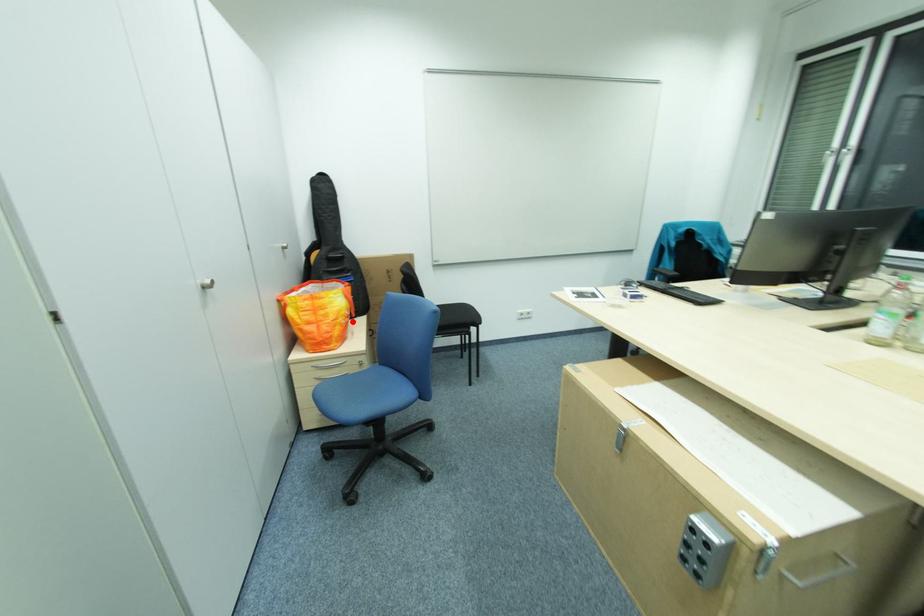
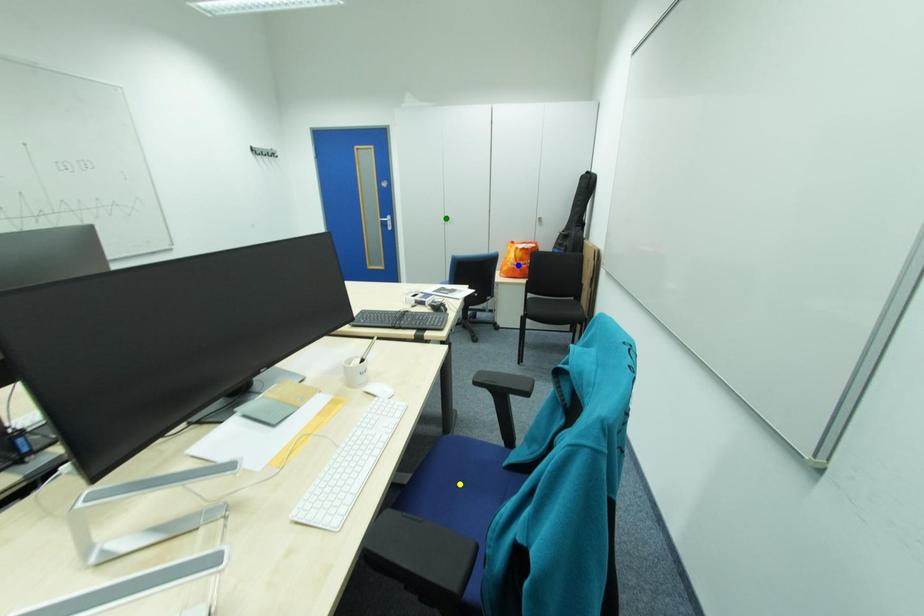
Question: I am providing you with two images of the same scene from different viewpoints. A red point is marked on the first image. You are given multiple points on the second image. In image 2, which mark is for the same physical point as the one in image 1?

Choices:
 (A) green point
 (B) yellow point
 (C) blue point

Answer: (C)